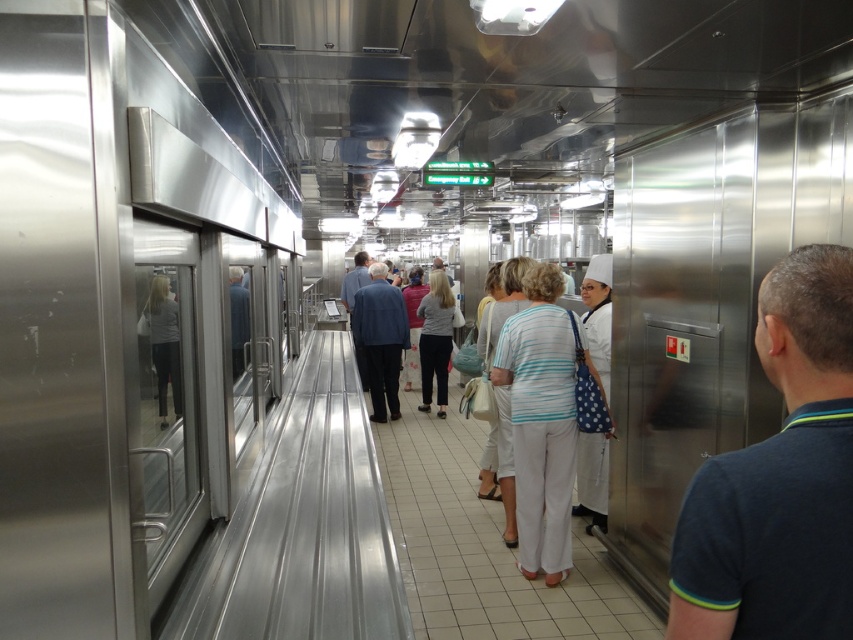
You are a tour guide leading a group through this kitchen. You need to ensure that everyone can walk in a single file line without touching any of the equipment. The white fabric dress at center and the white chef hat at center are both in the path. Which of these two items has a wider width and might require more space to avoid collision?

The white fabric dress at center has a larger width than the white chef hat at center, so it might require more space to avoid collision.

You are a tour guide leading a group in the commercial kitchen. You notice the dark blue shirt at right and the white dotted apron at center. Which person should you address first if you want to give instructions to someone in front?

You should address the dark blue shirt at right first because they are in front of the white dotted apron at center, making them closer to you.